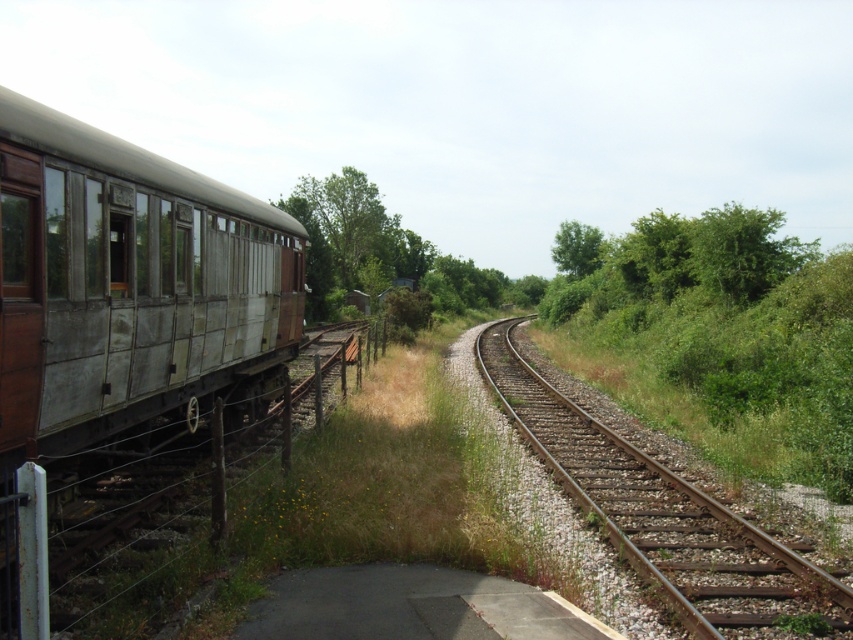
You are a maintenance worker needing to inspect the brown metal track at center and the green leafy shrub at right. From your current position at the left end of the track, which object will you encounter first as you walk along the track towards the right?

The brown metal track at center is to the left of the green leafy shrub at right, so you will encounter the brown metal track at center first as you walk along the track towards the right.

You are a railway inspector checking the alignment of the tracks. You notice the brown metal track at center and the green leafy tree at upper center in your view. Which object appears smaller in your field of view?

The brown metal track at center appears smaller compared to the green leafy tree at upper center in the field of view.